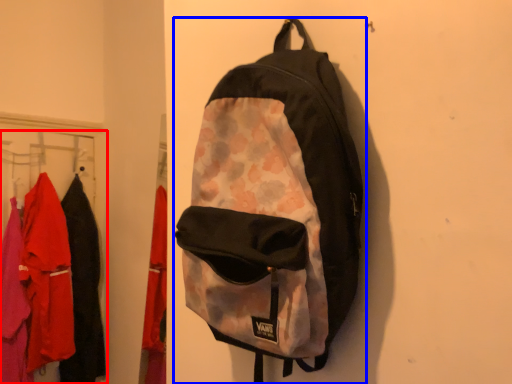
Question: Among these objects, which one is nearest to the camera, closet (highlighted by a red box) or backpack (highlighted by a blue box)?

Choices:
 (A) closet
 (B) backpack

Answer: (B)